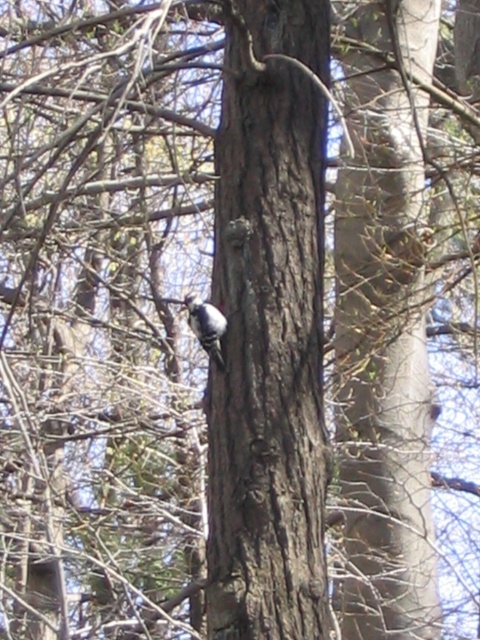
Question: Can you confirm if smooth brown bark at center is wider than white speckled woodpecker at center?

Choices:
 (A) no
 (B) yes

Answer: (B)

Question: Which point is closer to the camera?

Choices:
 (A) (205, 317)
 (B) (315, 476)

Answer: (B)

Question: Among these objects, which one is nearest to the camera?

Choices:
 (A) white speckled woodpecker at center
 (B) smooth brown bark at center

Answer: (B)

Question: Does smooth brown bark at center appear over white speckled woodpecker at center?

Choices:
 (A) yes
 (B) no

Answer: (A)

Question: Is smooth brown bark at center positioned before white speckled woodpecker at center?

Choices:
 (A) no
 (B) yes

Answer: (B)